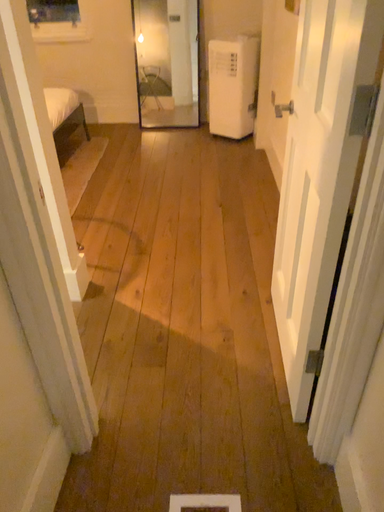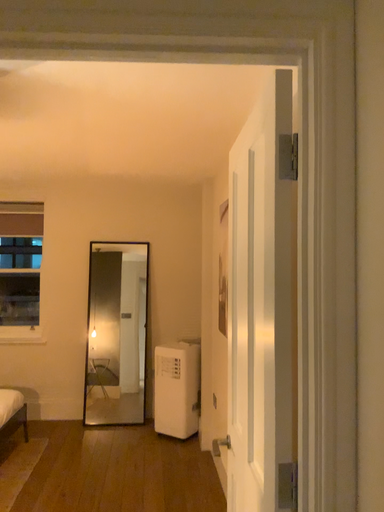
Question: Which way did the camera rotate in the video?

Choices:
 (A) rotated upward
 (B) rotated downward

Answer: (A)